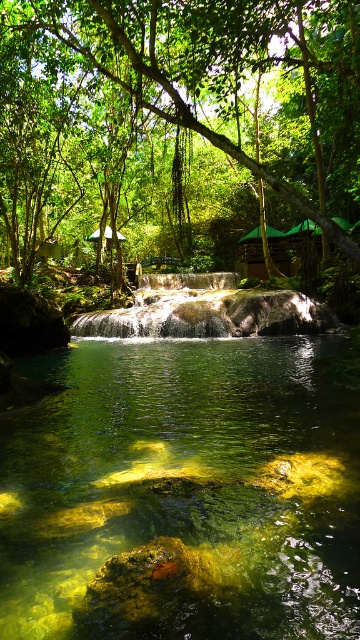
Which is in front, point (174, 346) or point (185, 92)?

Point (174, 346) is in front.

Between point (59, 429) and point (321, 180), which one is positioned behind?

The point (321, 180) is more distant.

This screenshot has width=360, height=640. Describe the element at coordinates (182, 493) in the screenshot. I see `translucent green water at center` at that location.

This screenshot has height=640, width=360. Find the location of `translucent green water at center`. translucent green water at center is located at coordinates (182, 493).